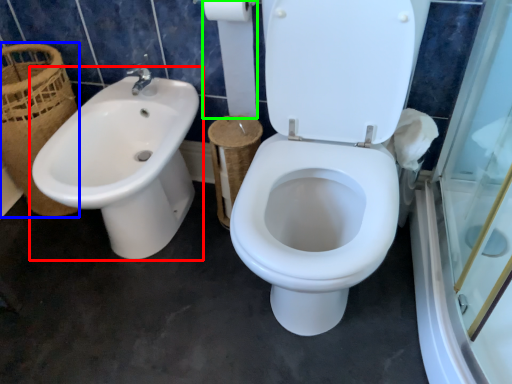
Question: Based on their relative distances, which object is farther from sink (highlighted by a red box)? Choose from basket (highlighted by a blue box) and toilet paper (highlighted by a green box).

Choices:
 (A) basket
 (B) toilet paper

Answer: (B)